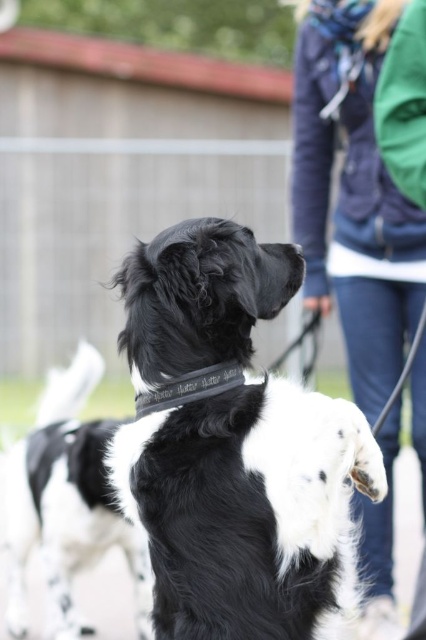
Question: Is black and white fur at center positioned behind black leather neckband at center?

Choices:
 (A) yes
 (B) no

Answer: (A)

Question: Which point is farther from the camera taking this photo?

Choices:
 (A) (290, 492)
 (B) (112, 422)

Answer: (B)

Question: Among these objects, which one is farthest from the camera?

Choices:
 (A) black leather neckband at center
 (B) black and white fur at center
 (C) black and white fur dog at center

Answer: (B)

Question: Which object appears farthest from the camera in this image?

Choices:
 (A) black and white fur dog at center
 (B) black and white fur at center
 (C) black leather neckband at center
 (D) denim jacket at upper center

Answer: (B)

Question: Does black and white fur dog at center have a larger size compared to black leather neckband at center?

Choices:
 (A) yes
 (B) no

Answer: (A)

Question: Does denim jacket at upper center have a larger size compared to black and white fur at center?

Choices:
 (A) yes
 (B) no

Answer: (A)